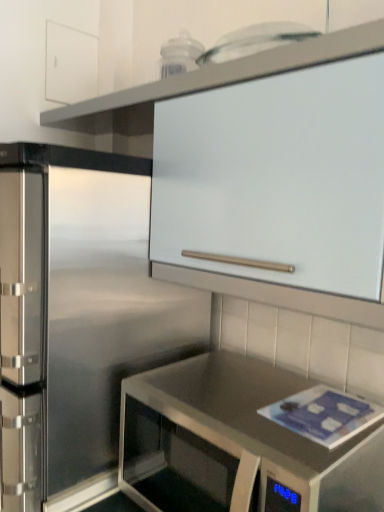
Question: Does white matte cabinet at upper center, the 2th cabinetry in the top-to-bottom sequence, have a smaller size compared to stainless steel countertop at lower right?

Choices:
 (A) no
 (B) yes

Answer: (A)

Question: Is white matte cabinet at upper center, the 2th cabinetry in the top-to-bottom sequence, oriented away from stainless steel countertop at lower right?

Choices:
 (A) yes
 (B) no

Answer: (B)

Question: Is white matte cabinet at upper center, acting as the 1th cabinetry starting from the right, beside stainless steel countertop at lower right?

Choices:
 (A) no
 (B) yes

Answer: (A)

Question: Is white matte cabinet at upper center, placed as the 1th cabinetry when sorted from bottom to top, at the left side of stainless steel countertop at lower right?

Choices:
 (A) no
 (B) yes

Answer: (B)

Question: Considering the relative sizes of white matte cabinet at upper center, acting as the 1th cabinetry starting from the right, and stainless steel countertop at lower right in the image provided, is white matte cabinet at upper center, acting as the 1th cabinetry starting from the right, bigger than stainless steel countertop at lower right?

Choices:
 (A) no
 (B) yes

Answer: (B)

Question: Considering their positions, is white matte cabinet at upper center, which ranks as the 2th cabinetry in left-to-right order, located in front of or behind white matte cabinet at upper left, arranged as the 1th cabinetry when viewed from the top?

Choices:
 (A) behind
 (B) front

Answer: (B)

Question: Would you say white matte cabinet at upper center, acting as the 1th cabinetry starting from the right, is inside or outside white matte cabinet at upper left, which appears as the first cabinetry when viewed from the left?

Choices:
 (A) inside
 (B) outside

Answer: (B)

Question: Considering the positions of point (238, 293) and point (74, 96), is point (238, 293) closer or farther from the camera than point (74, 96)?

Choices:
 (A) farther
 (B) closer

Answer: (B)

Question: From a real-world perspective, relative to white matte cabinet at upper left, which appears as the first cabinetry when viewed from the left, is white matte cabinet at upper center, which ranks as the 2th cabinetry in left-to-right order, vertically above or below?

Choices:
 (A) above
 (B) below

Answer: (B)

Question: From a real-world perspective, is white matte cabinet at upper left, the 1th cabinetry in the back-to-front sequence, physically located above or below stainless steel countertop at lower right?

Choices:
 (A) above
 (B) below

Answer: (A)

Question: Is point (77, 58) positioned closer to the camera than point (274, 393)?

Choices:
 (A) closer
 (B) farther

Answer: (B)

Question: Considering the positions of white matte cabinet at upper left, the 1th cabinetry in the back-to-front sequence, and stainless steel countertop at lower right in the image, is white matte cabinet at upper left, the 1th cabinetry in the back-to-front sequence, taller or shorter than stainless steel countertop at lower right?

Choices:
 (A) tall
 (B) short

Answer: (B)

Question: In terms of width, does white matte cabinet at upper left, which appears as the first cabinetry when viewed from the left, look wider or thinner when compared to stainless steel countertop at lower right?

Choices:
 (A) wide
 (B) thin

Answer: (B)

Question: Is white matte cabinet at upper left, marked as the second cabinetry in a bottom-to-top arrangement, inside the boundaries of white matte cabinet at upper center, acting as the 1th cabinetry starting from the right, or outside?

Choices:
 (A) outside
 (B) inside

Answer: (A)

Question: From the image's perspective, is white matte cabinet at upper left, positioned as the 2th cabinetry in right-to-left order, above or below white matte cabinet at upper center, which ranks as the 2th cabinetry in left-to-right order?

Choices:
 (A) below
 (B) above

Answer: (B)